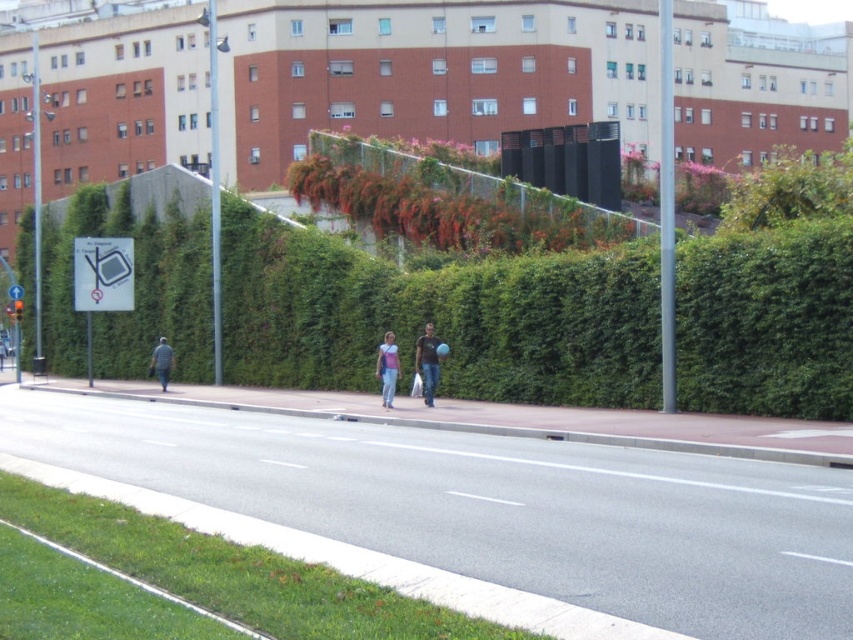
You are a delivery person standing at the sidewalk and need to deliver a package to the building. The package requires a clear path of at least 100 feet between the sidewalk and the building entrance. Is the distance between the green leafy bush at upper center and the denim jeans at center sufficient for this requirement?

The green leafy bush at upper center and denim jeans at center are 117.87 feet apart, which is more than the required 100 feet, so the distance is sufficient for the delivery package requirement.

You are a pedestrian standing on the sidewalk near the denim jeans at center. You want to walk to the building entrance located behind the green leafy bush at upper center. Is there enough space between the bush and the sidewalk to pass through comfortably?

The green leafy bush at upper center is wider than the denim jeans at center. Since the bush is wider, it might block part of the sidewalk, leaving less space to walk. However, the exact width of the sidewalk isnanot provided, so it depends on how much space remains after accounting for the bush.

You are standing at the origin point of the image. Which direction should you move to reach the green leafy bush at upper center?

You should move towards the upper center direction to reach the green leafy bush at upper center located at point [445,200].